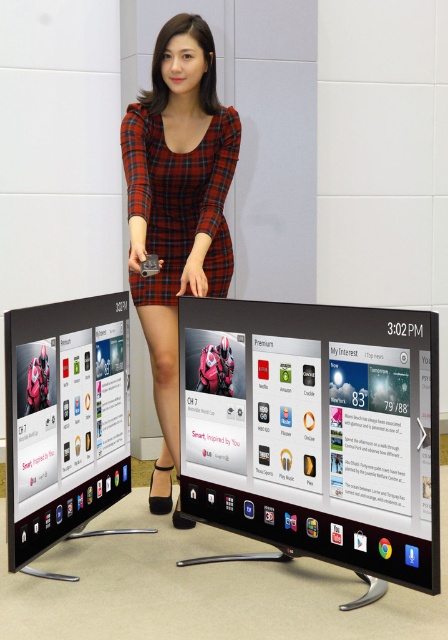
Question: Which object is positioned closest to the plaid fabric dress at center?

Choices:
 (A) black glossy screen at center
 (B) red plaid dress at center

Answer: (B)

Question: Is red plaid dress at center to the left of plaid fabric dress at center from the viewer's perspective?

Choices:
 (A) no
 (B) yes

Answer: (B)

Question: Which object is positioned farthest from the matte black screen at center?

Choices:
 (A) black glossy screen at center
 (B) plaid fabric dress at center

Answer: (A)

Question: Which object is positioned farthest from the red plaid dress at center?

Choices:
 (A) black glossy screen at center
 (B) matte black screen at center

Answer: (A)

Question: Does black glossy screen at center come in front of red plaid dress at center?

Choices:
 (A) no
 (B) yes

Answer: (B)

Question: Can you confirm if red plaid dress at center is positioned above matte black screen at center?

Choices:
 (A) yes
 (B) no

Answer: (A)